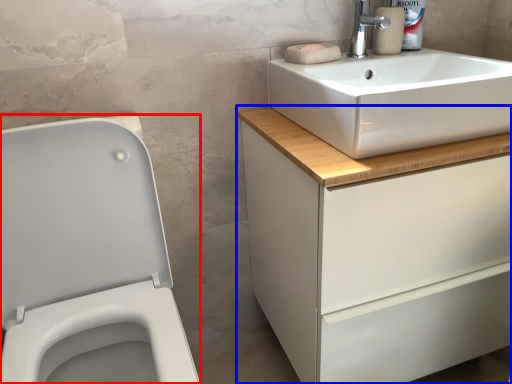
Question: Among these objects, which one is nearest to the camera, porcelain (highlighted by a red box) or bathroom cabinet (highlighted by a blue box)?

Choices:
 (A) porcelain
 (B) bathroom cabinet

Answer: (A)